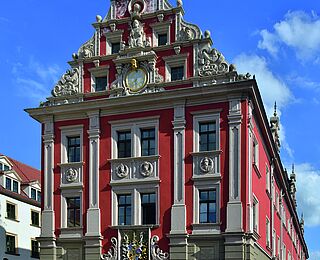
I want to click on statue, so click(139, 38).